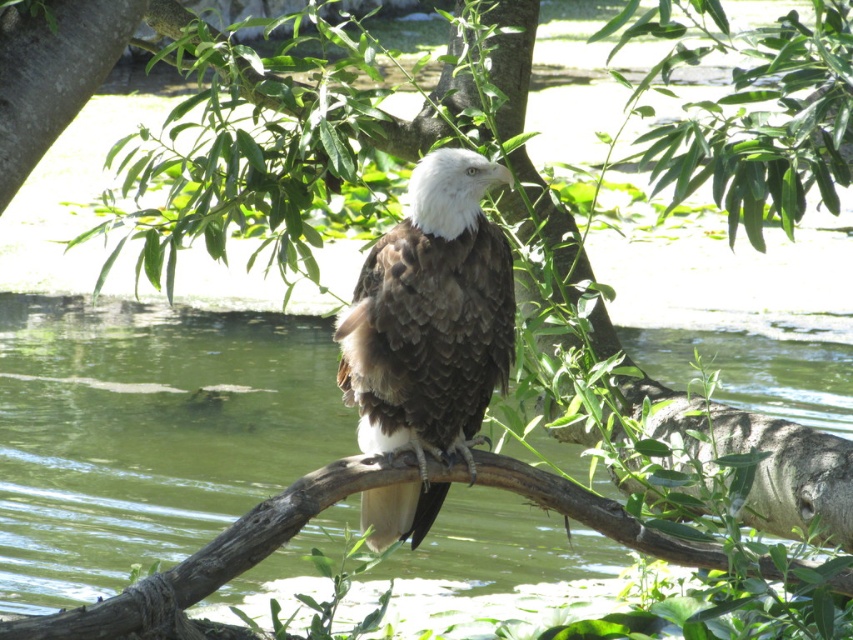
Which of these two, brown feathered bald eagle at center or brown rough tree branch at center, stands taller?

With more height is brown feathered bald eagle at center.

Who is positioned more to the right, brown feathered bald eagle at center or brown rough tree branch at center?

brown rough tree branch at center is more to the right.

In order to click on brown feathered bald eagle at center in this screenshot , I will do `click(428, 336)`.